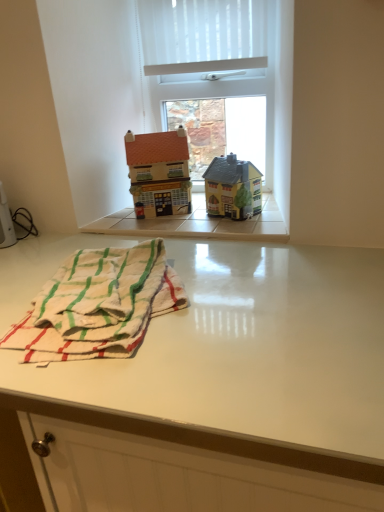
Find the location of a particular element. vacant area that lies in front of matte brown house at center, marked as the 2th toy in a right-to-left arrangement is located at coordinates (169, 226).